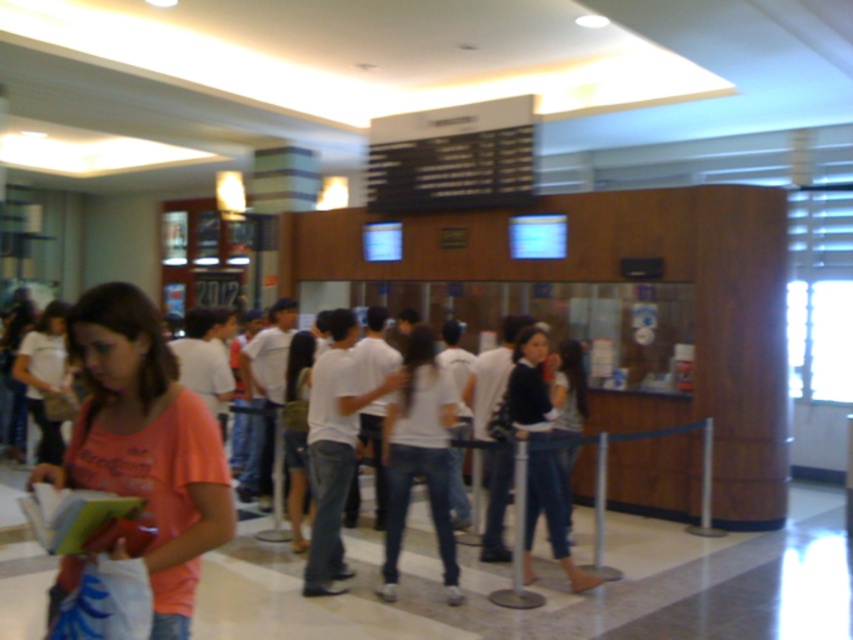
Can you confirm if matte pink t-shirt at center is bigger than denim jeans at center?

No, matte pink t-shirt at center is not bigger than denim jeans at center.

This screenshot has width=853, height=640. What do you see at coordinates (146, 444) in the screenshot?
I see `matte pink t-shirt at center` at bounding box center [146, 444].

At what (x,y) coordinates should I click in order to perform the action: click on matte pink t-shirt at center. Please return your answer as a coordinate pair (x, y). The image size is (853, 640). Looking at the image, I should click on (146, 444).